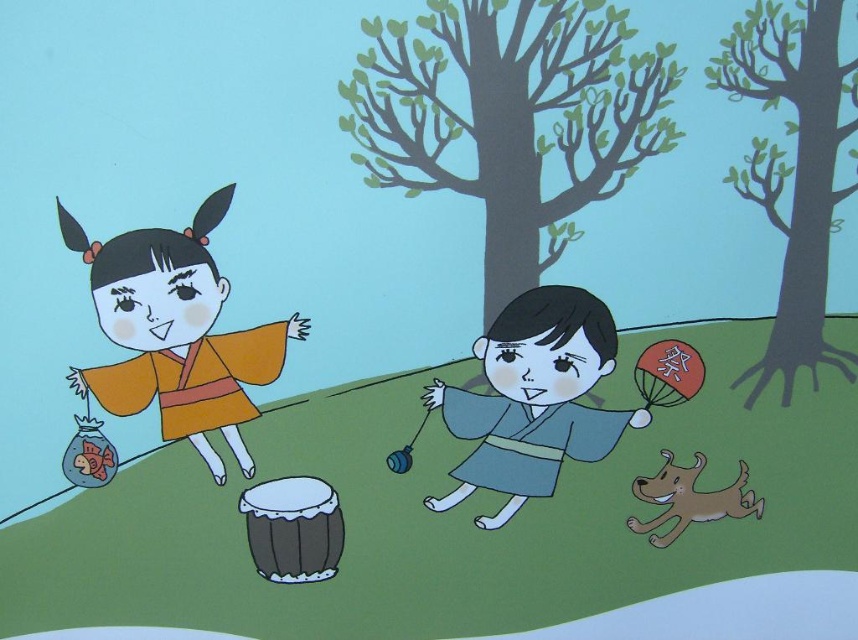
You are a photographer taking a picture of the two points in the scene. Which point, point (475, 344) or point (723, 493), will appear larger in the photo?

Point (475, 344) will appear larger in the photo because it is closer to the camera than point (723, 493).

You are a character in the scene and want to place a small sticker exactly at the point marked by the coordinates point [176,333]. Which object should you look for to place it there?

The point [176,333] is on the orange matte kimono at left, so you should place the sticker there.